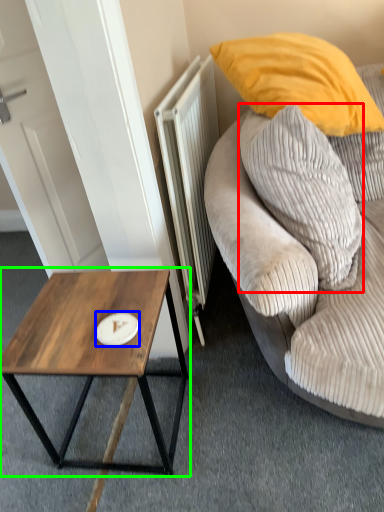
Question: Based on their relative distances, which object is farther from pillow (highlighted by a red box)? Choose from plate (highlighted by a blue box) and coffee table (highlighted by a green box).

Choices:
 (A) plate
 (B) coffee table

Answer: (A)